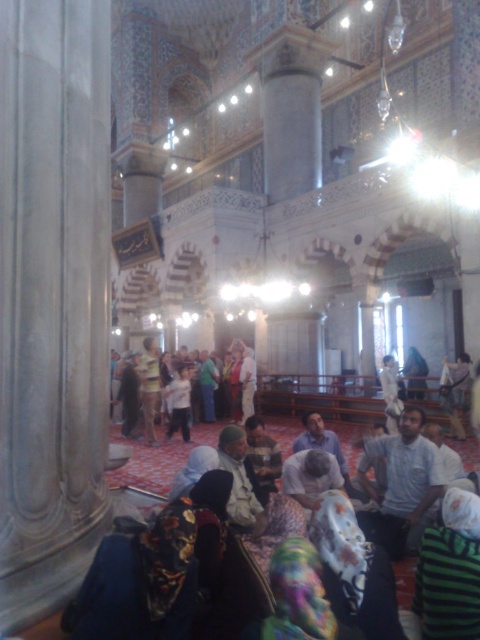
Is light gray shirt at center thinner than light brown leather jacket at center?

Correct, light gray shirt at center's width is less than light brown leather jacket at center's.

Can you confirm if light gray shirt at center is positioned to the left of light brown leather jacket at center?

No, light gray shirt at center is not to the left of light brown leather jacket at center.

Image resolution: width=480 pixels, height=640 pixels. Find the location of `light gray shirt at center`. light gray shirt at center is located at coordinates (400, 483).